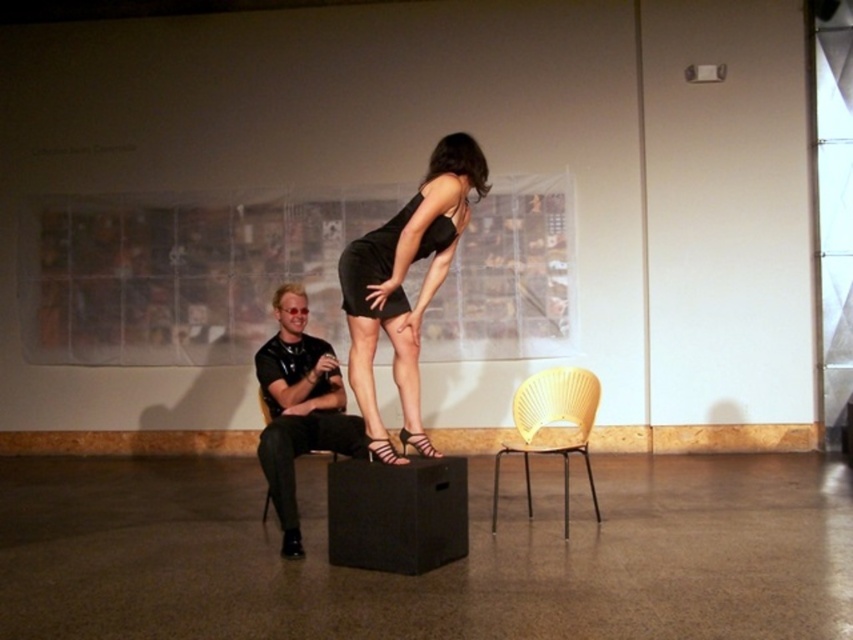
You are standing in the art installation and see two points marked in the scene. Which point, point (410, 244) or point (413, 444), is closer to you?

Point (410, 244) is closer to the viewer than point (413, 444).

You are an event planner setting up for a photoshoot in the described space. You need to place a tripod exactly at the center of the room. The black satin dress at center is currently occupying the center point. Can you move the dress to the side to make space for the tripod without moving any other objects?

The black satin dress at center is located at point (405, 273), which is very close to the center of the room. Moving it slightly to the side would allow space for the tripod while keeping other objects undisturbed.

You are a fashion designer observing the scene. You need to place a belt between the black matte dress at center and the striped leather sandal at center. Can the belt fit in the space between them?

The distance between the black matte dress at center and the striped leather sandal at center is 38.36 inches. Since the belt is typically shorter than this distance, it should fit comfortably in the space between them.